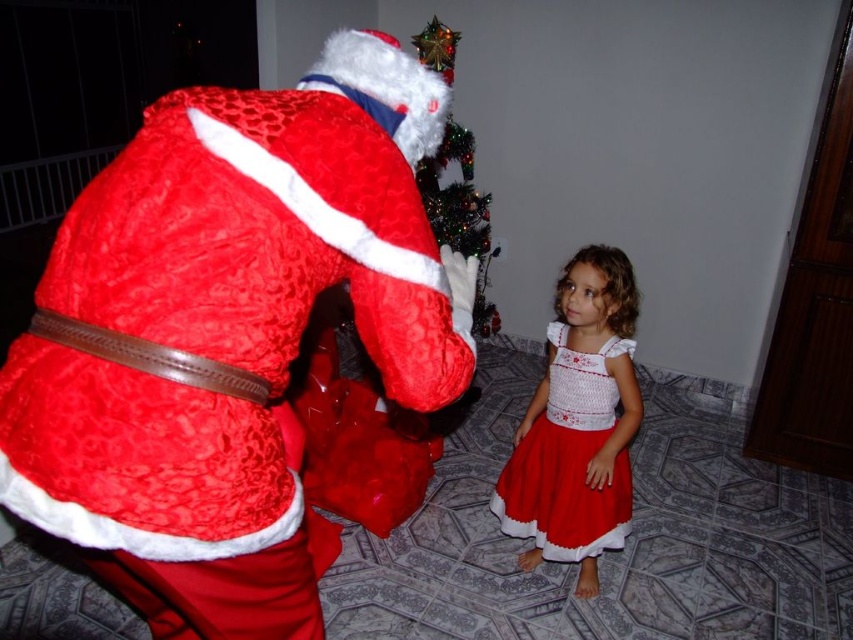
Is velvet red santa claus at upper left to the left of green glittery christmas tree at upper center from the viewer's perspective?

Indeed, velvet red santa claus at upper left is positioned on the left side of green glittery christmas tree at upper center.

Can you confirm if velvet red santa claus at upper left is smaller than green glittery christmas tree at upper center?

Yes.

Where is `velvet red santa claus at upper left`? The width and height of the screenshot is (853, 640). velvet red santa claus at upper left is located at coordinates (228, 332).

Is velvet red santa claus at upper left behind white crochet dress at lower right?

No, it is in front of white crochet dress at lower right.

Between velvet red santa claus at upper left and white crochet dress at lower right, which one is positioned higher?

velvet red santa claus at upper left is above.

Locate an element on the screen. The image size is (853, 640). velvet red santa claus at upper left is located at coordinates (228, 332).

Which is more to the left, white crochet dress at lower right or green glittery christmas tree at upper center?

From the viewer's perspective, green glittery christmas tree at upper center appears more on the left side.

This screenshot has width=853, height=640. I want to click on white crochet dress at lower right, so click(567, 460).

What are the coordinates of `white crochet dress at lower right` in the screenshot? It's located at 567,460.